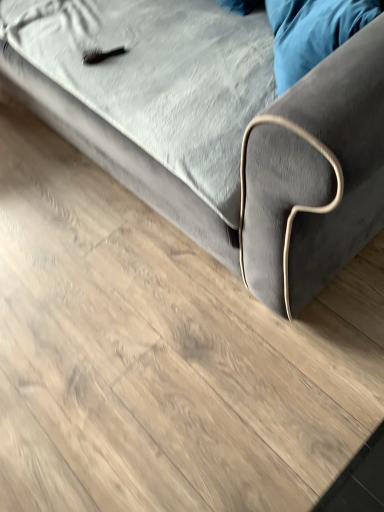
Measure the distance between point [277,106] and camera.

A distance of 25.28 inches exists between point [277,106] and camera.

You are a GUI agent. You are given a task and a screenshot of the screen. Output one action in this format:
    pyautogui.click(x=<x>, y=<y>)
    Task: Click on the velvet gray couch at upper center
    
    Given the screenshot: What is the action you would take?
    pyautogui.click(x=215, y=128)

Measure the distance between velvet gray couch at upper center and camera.

They are 23.16 inches apart.

This screenshot has height=512, width=384. Describe the element at coordinates (215, 128) in the screenshot. I see `velvet gray couch at upper center` at that location.

Locate an element on the screen. The image size is (384, 512). velvet blue pillow at upper right is located at coordinates pos(312,32).

Describe the element at coordinates (312, 32) in the screenshot. I see `velvet blue pillow at upper right` at that location.

I want to click on velvet gray couch at upper center, so click(x=215, y=128).

Which object is positioned more to the left, velvet gray couch at upper center or velvet blue pillow at upper right?

From the viewer's perspective, velvet gray couch at upper center appears more on the left side.

Considering the positions of objects velvet gray couch at upper center and velvet blue pillow at upper right in the image provided, who is in front, velvet gray couch at upper center or velvet blue pillow at upper right?

velvet gray couch at upper center is closer to the camera.

Considering the positions of point (146, 108) and point (271, 17), is point (146, 108) closer or farther from the camera than point (271, 17)?

Point (146, 108) is farther from the camera than point (271, 17).

From the image's perspective, is velvet gray couch at upper center on top of velvet blue pillow at upper right?

Yes, from the image's perspective, velvet gray couch at upper center is over velvet blue pillow at upper right.

From a real-world perspective, is velvet gray couch at upper center positioned under velvet blue pillow at upper right based on gravity?

Yes.

Considering the relative sizes of velvet gray couch at upper center and velvet blue pillow at upper right in the image provided, is velvet gray couch at upper center wider than velvet blue pillow at upper right?

Correct, the width of velvet gray couch at upper center exceeds that of velvet blue pillow at upper right.

Which of these two, velvet gray couch at upper center or velvet blue pillow at upper right, stands taller?

Standing taller between the two is velvet gray couch at upper center.

In terms of size, does velvet gray couch at upper center appear bigger or smaller than velvet blue pillow at upper right?

Considering their sizes, velvet gray couch at upper center takes up more space than velvet blue pillow at upper right.

Is velvet blue pillow at upper right surrounded by velvet gray couch at upper center?

Yes, velvet gray couch at upper center is surrounding velvet blue pillow at upper right.

Is velvet gray couch at upper center far from velvet blue pillow at upper right?

No, velvet gray couch at upper center is not far from velvet blue pillow at upper right.

Is velvet gray couch at upper center facing towards velvet blue pillow at upper right?

Yes, velvet gray couch at upper center faces towards velvet blue pillow at upper right.

Find the location of `pillow below the velvet gray couch at upper center (from the image's perspective)`. pillow below the velvet gray couch at upper center (from the image's perspective) is located at coordinates (312, 32).

Based on the photo, which is more to the right, velvet blue pillow at upper right or velvet gray couch at upper center?

From the viewer's perspective, velvet blue pillow at upper right appears more on the right side.

Considering the relative positions of velvet blue pillow at upper right and velvet gray couch at upper center in the image provided, is velvet blue pillow at upper right behind velvet gray couch at upper center?

That is True.

Considering the positions of points (353, 34) and (294, 185), is point (353, 34) farther from camera compared to point (294, 185)?

Yes, point (353, 34) is farther from viewer.

From the image's perspective, does velvet blue pillow at upper right appear higher than velvet gray couch at upper center?

Actually, velvet blue pillow at upper right appears below velvet gray couch at upper center in the image.

From a real-world perspective, which object rests below the other?

velvet gray couch at upper center, from a real-world perspective.

Between velvet blue pillow at upper right and velvet gray couch at upper center, which one has smaller width?

velvet blue pillow at upper right.

Does velvet blue pillow at upper right have a greater height compared to velvet gray couch at upper center?

In fact, velvet blue pillow at upper right may be shorter than velvet gray couch at upper center.

Is velvet blue pillow at upper right smaller than velvet gray couch at upper center?

Indeed, velvet blue pillow at upper right has a smaller size compared to velvet gray couch at upper center.

Is velvet blue pillow at upper right positioned beyond the bounds of velvet gray couch at upper center?

No, velvet blue pillow at upper right is inside velvet gray couch at upper center's boundary.

Is velvet blue pillow at upper right next to velvet gray couch at upper center?

No, velvet blue pillow at upper right is not in contact with velvet gray couch at upper center.

Is velvet blue pillow at upper right facing away from velvet gray couch at upper center?

Yes, velvet gray couch at upper center is at the back of velvet blue pillow at upper right.

How many degrees apart are the facing directions of velvet blue pillow at upper right and velvet gray couch at upper center?

The facing directions of velvet blue pillow at upper right and velvet gray couch at upper center are 48.1 degrees apart.

This screenshot has height=512, width=384. In order to click on pillow on the right of velvet gray couch at upper center in this screenshot , I will do `click(312, 32)`.

Identify the location of studio couch on the left of the velvet blue pillow at upper right. (215, 128).

I want to click on studio couch in front of the velvet blue pillow at upper right, so click(215, 128).